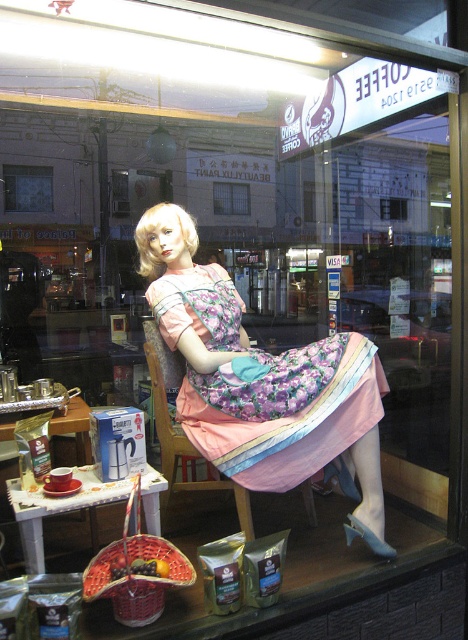
Question: Can you confirm if wooden chair at center is positioned above clear glass window at center?

Choices:
 (A) yes
 (B) no

Answer: (B)

Question: Among these objects, which one is nearest to the camera?

Choices:
 (A) clear glass window at center
 (B) wooden chair at center
 (C) floral fabric dress at center
 (D) transparent glass window at upper left

Answer: (C)

Question: Which of the following is the closest to the observer?

Choices:
 (A) wooden chair at center
 (B) transparent glass window at upper left
 (C) clear glass window at center

Answer: (A)

Question: Can you confirm if wooden chair at center is thinner than clear glass window at center?

Choices:
 (A) yes
 (B) no

Answer: (A)

Question: Is floral fabric dress at center wider than transparent glass window at upper left?

Choices:
 (A) yes
 (B) no

Answer: (A)

Question: Which of the following is the farthest from the observer?

Choices:
 (A) (182, 486)
 (B) (372, 451)
 (C) (30, 192)
 (D) (243, 200)

Answer: (D)